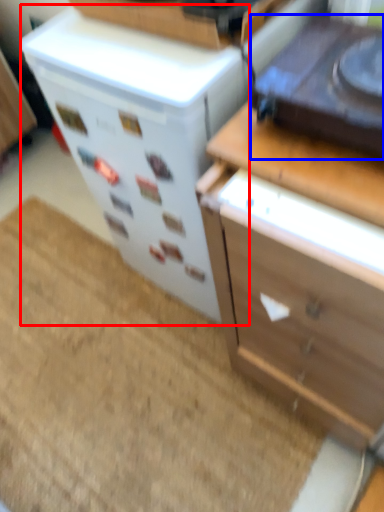
Question: Which point is further to the camera, appliance (highlighted by a red box) or appliance (highlighted by a blue box)?

Choices:
 (A) appliance
 (B) appliance

Answer: (A)